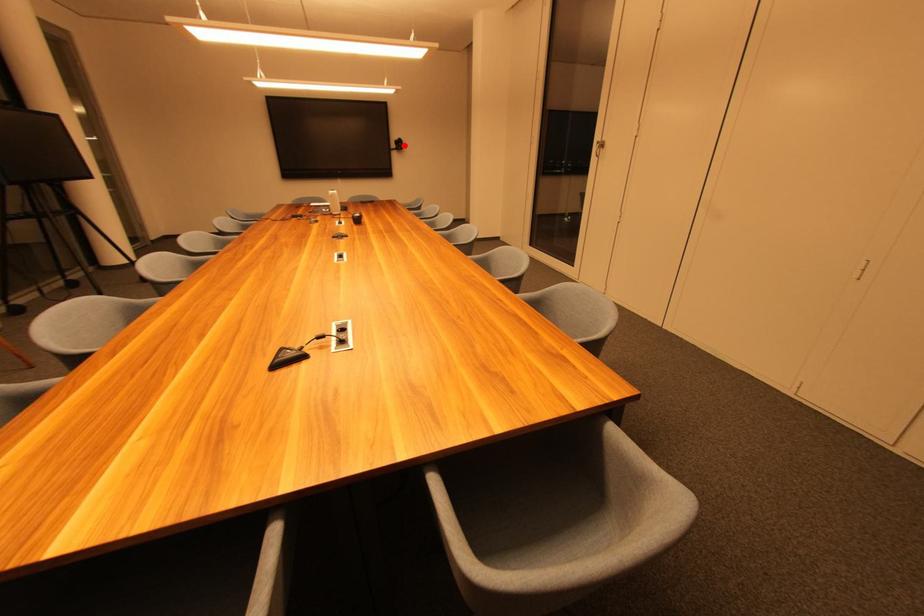
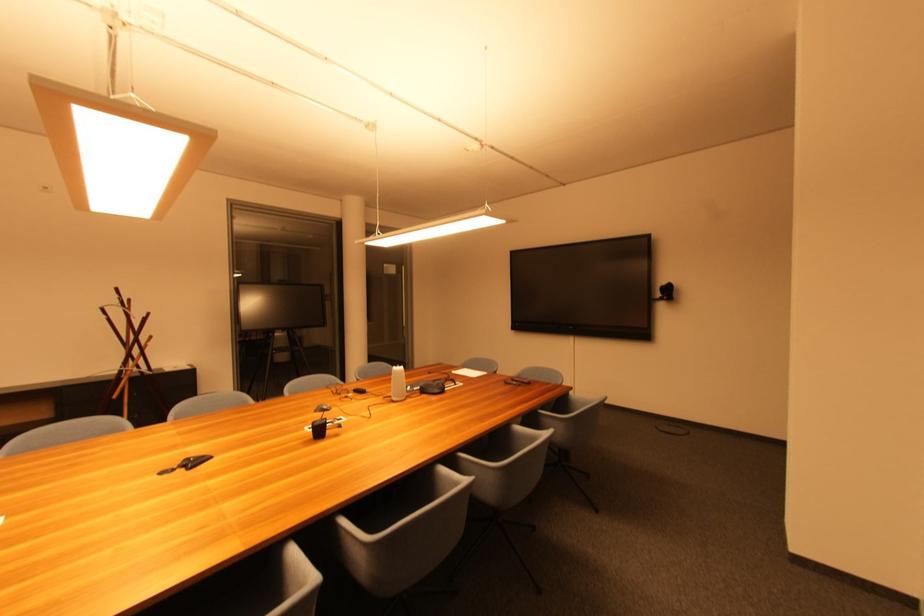
In the second image, find the point that corresponds to the highlighted location in the first image.

(673, 292)